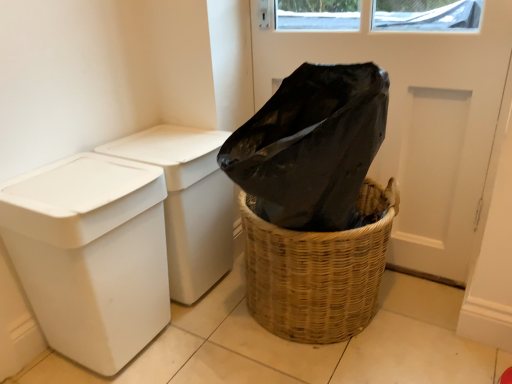
Question: Can we say black plastic screen door at upper center lies outside white plastic bin at left, which is counted as the second waste container, starting from the back?

Choices:
 (A) yes
 (B) no

Answer: (A)

Question: Is black plastic screen door at upper center positioned with its back to white plastic bin at left, which is the 1th waste container in front-to-back order?

Choices:
 (A) yes
 (B) no

Answer: (B)

Question: Considering the relative sizes of black plastic screen door at upper center and white plastic bin at left, which is the 1th waste container in front-to-back order, in the image provided, is black plastic screen door at upper center taller than white plastic bin at left, which is the 1th waste container in front-to-back order,?

Choices:
 (A) no
 (B) yes

Answer: (B)

Question: Is black plastic screen door at upper center shorter than white plastic bin at left, which is counted as the second waste container, starting from the back?

Choices:
 (A) no
 (B) yes

Answer: (A)

Question: Does black plastic screen door at upper center have a greater width compared to white plastic bin at left, which is counted as the second waste container, starting from the back?

Choices:
 (A) yes
 (B) no

Answer: (B)

Question: From a real-world perspective, is black plastic screen door at upper center positioned under white plastic bin at left, which is counted as the second waste container, starting from the back, based on gravity?

Choices:
 (A) no
 (B) yes

Answer: (A)

Question: Is white plastic bin at left, marked as the 1th waste container in a back-to-front arrangement, aimed at woven brown basket at lower right?

Choices:
 (A) yes
 (B) no

Answer: (A)

Question: Is white plastic bin at left, marked as the 1th waste container in a back-to-front arrangement, outside of woven brown basket at lower right?

Choices:
 (A) no
 (B) yes

Answer: (B)

Question: Is white plastic bin at left, which is the 2th waste container from front to back, smaller than woven brown basket at lower right?

Choices:
 (A) no
 (B) yes

Answer: (B)

Question: Considering the relative sizes of white plastic bin at left, marked as the 1th waste container in a back-to-front arrangement, and woven brown basket at lower right in the image provided, is white plastic bin at left, marked as the 1th waste container in a back-to-front arrangement, bigger than woven brown basket at lower right?

Choices:
 (A) no
 (B) yes

Answer: (A)

Question: Is white plastic bin at left, marked as the 1th waste container in a back-to-front arrangement, oriented away from woven brown basket at lower right?

Choices:
 (A) no
 (B) yes

Answer: (A)

Question: Is white plastic bin at left, marked as the 1th waste container in a back-to-front arrangement, touching woven brown basket at lower right?

Choices:
 (A) no
 (B) yes

Answer: (A)

Question: From the image's perspective, is woven brown basket at lower right beneath white plastic bin at left, marked as the 1th waste container in a back-to-front arrangement?

Choices:
 (A) no
 (B) yes

Answer: (B)